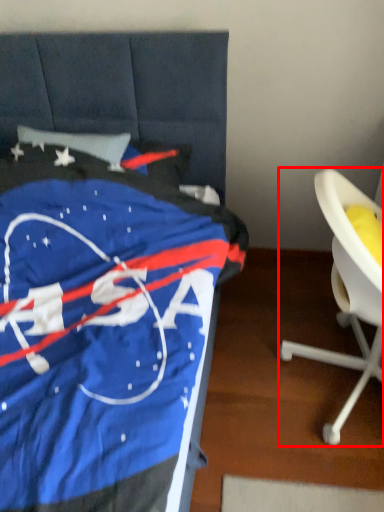
Question: Observing the image, what is the correct spatial positioning of chair (annotated by the red box) in reference to furniture?

Choices:
 (A) left
 (B) right

Answer: (B)